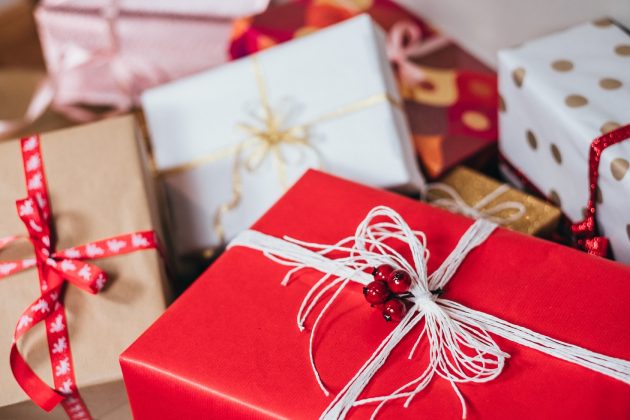
This screenshot has height=420, width=630. Find the location of `wrapped gifts`. wrapped gifts is located at coordinates (212, 312), (127, 294), (209, 154), (151, 37), (215, 5), (411, 81), (472, 193), (576, 99).